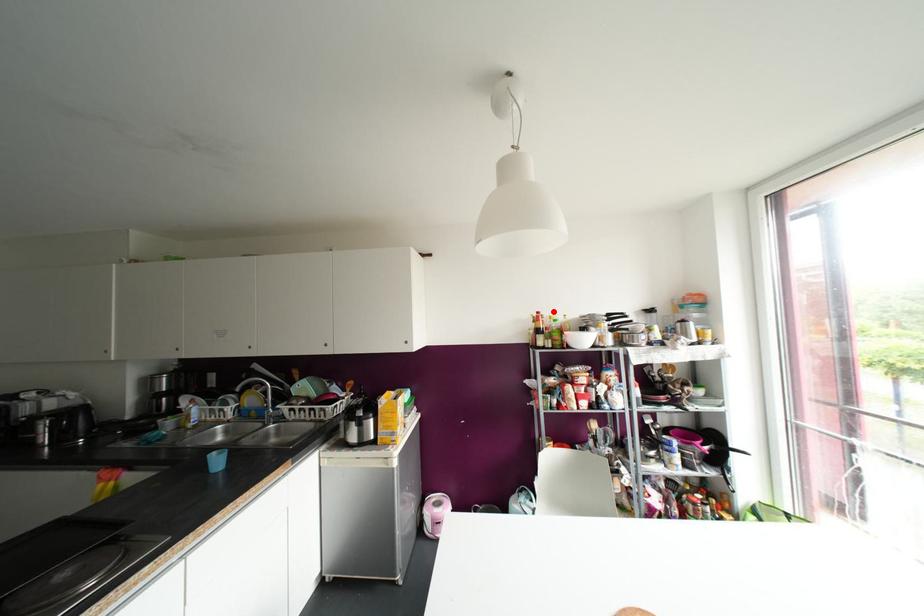
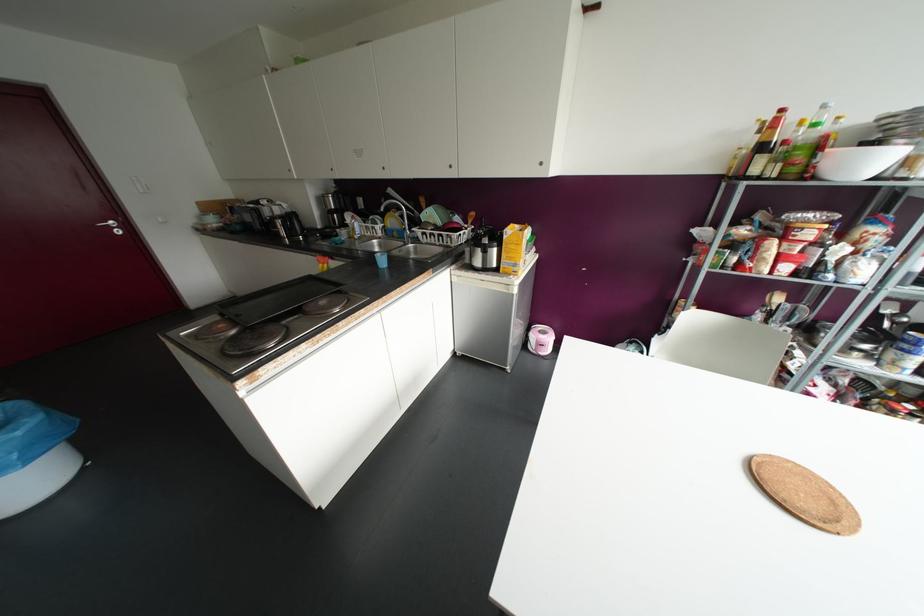
Locate, in the second image, the point that corresponds to the highlighted location in the first image.

(823, 106)